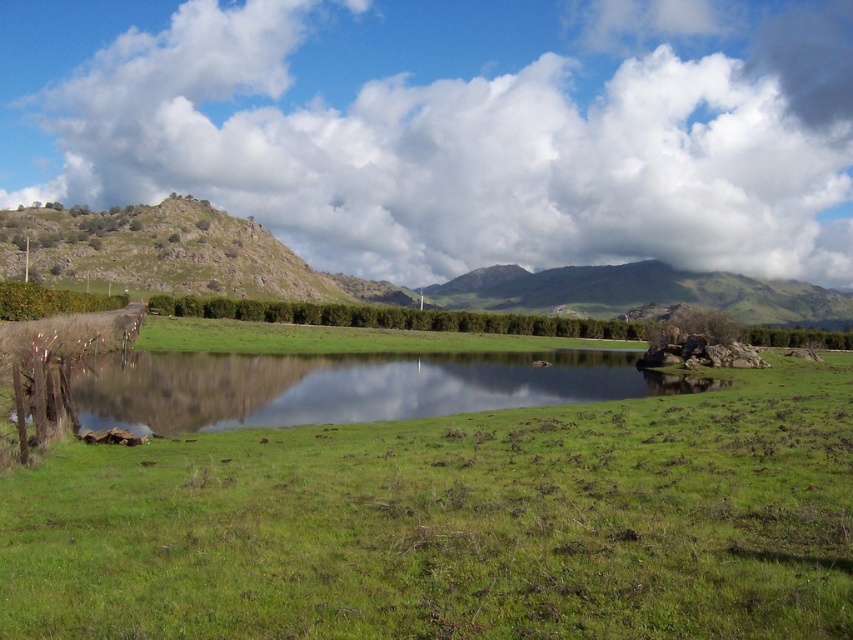
Can you confirm if green grassy at center is smaller than green grassy hill at center?

Yes.

Based on the photo, can you confirm if green grassy at center is taller than green grassy hill at center?

No, green grassy at center is not taller than green grassy hill at center.

The image size is (853, 640). Find the location of `green grassy at center`. green grassy at center is located at coordinates (456, 524).

Image resolution: width=853 pixels, height=640 pixels. What do you see at coordinates (451, 125) in the screenshot? I see `cloudy sky at upper center` at bounding box center [451, 125].

Who is more forward, (646,248) or (526,387)?

Point (526,387) is more forward.

Identify the location of cloudy sky at upper center. (451, 125).

Is cloudy sky at upper center thinner than green grassy hill at center?

Incorrect, cloudy sky at upper center's width is not less than green grassy hill at center's.

Between cloudy sky at upper center and green grassy hill at center, which one is positioned lower?

Positioned lower is green grassy hill at center.

Locate an element on the screen. cloudy sky at upper center is located at coordinates (451, 125).

The width and height of the screenshot is (853, 640). Find the location of `cloudy sky at upper center`. cloudy sky at upper center is located at coordinates (451, 125).